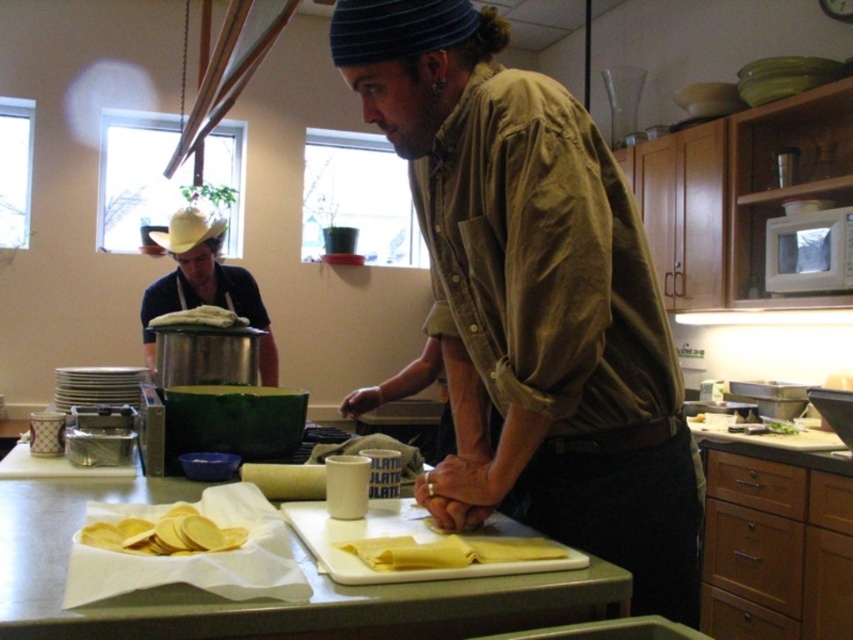
Question: Which is nearer to the yellow straw cowboy hat at upper left?

Choices:
 (A) matte silver pot at left
 (B) yellow matte chips at lower left
 (C) brown corduroy shirt at center
 (D) yellow matte pasta at center

Answer: (A)

Question: Among these objects, which one is farthest from the camera?

Choices:
 (A) yellow matte pasta at center
 (B) yellow matte chips at lower left

Answer: (A)

Question: Does yellow matte pasta at center appear on the right side of yellow matte chips at lower left?

Choices:
 (A) yes
 (B) no

Answer: (A)

Question: Which is farther from the yellow matte pasta at center?

Choices:
 (A) matte silver pot at left
 (B) white cloth at center
 (C) brown corduroy shirt at center

Answer: (A)

Question: Can you confirm if yellow straw cowboy hat at upper left is positioned to the right of white cloth at center?

Choices:
 (A) yes
 (B) no

Answer: (B)

Question: In this image, where is brown corduroy shirt at center located relative to white cloth at center?

Choices:
 (A) below
 (B) above

Answer: (A)